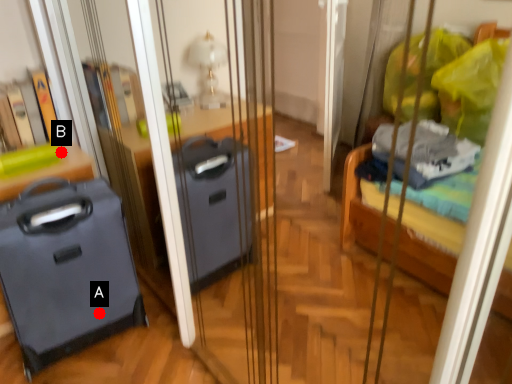
Question: Two points are circled on the image, labeled by A and B beside each circle. Among these points, which one is farthest from the camera?

Choices:
 (A) A is further
 (B) B is further

Answer: (B)